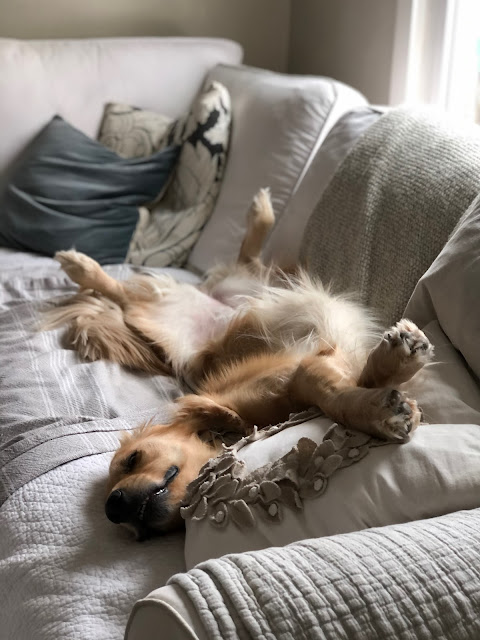
Find the location of a particular element. This screenshot has height=640, width=480. couch is located at coordinates (350, 214).